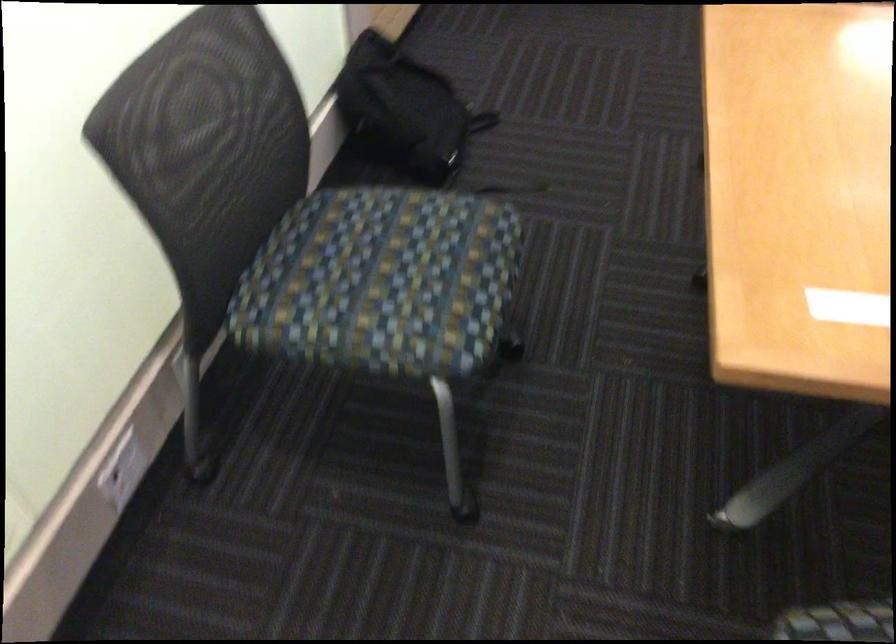
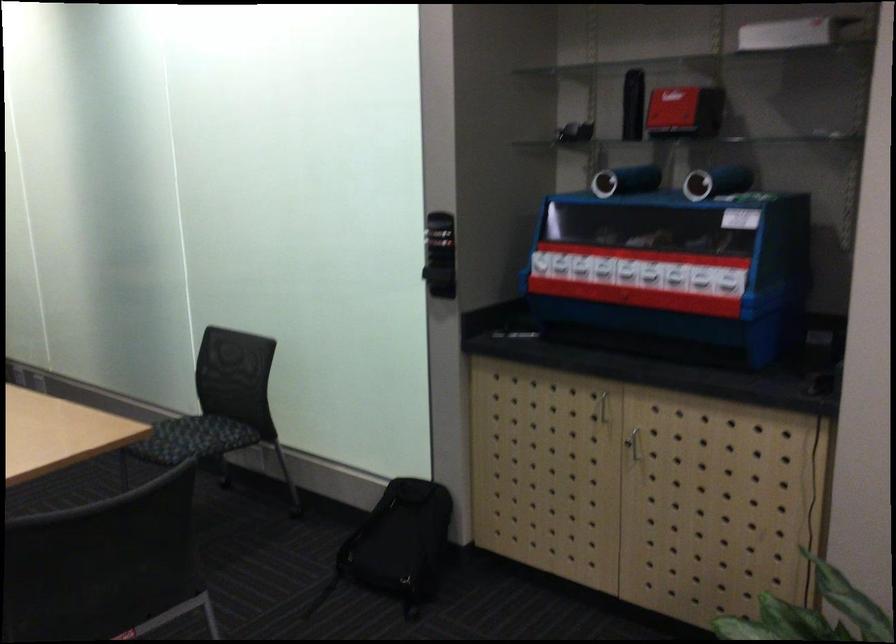
Where in the second image is the point corresponding to (440,88) from the first image?

(398, 545)